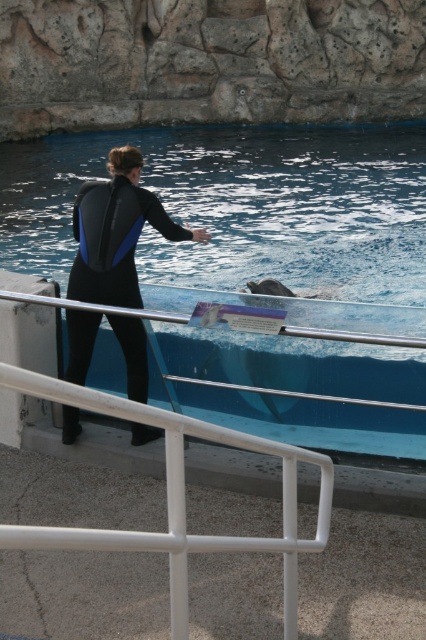
Question: Is blue smooth pool at center above black neoprene wetsuit at center?

Choices:
 (A) no
 (B) yes

Answer: (B)

Question: Which object appears farthest from the camera in this image?

Choices:
 (A) blue smooth pool at center
 (B) black neoprene wetsuit at center

Answer: (A)

Question: Which of the following is the closest to the observer?

Choices:
 (A) (80, 378)
 (B) (109, 340)

Answer: (A)

Question: Does blue smooth pool at center have a lesser width compared to black neoprene wetsuit at center?

Choices:
 (A) no
 (B) yes

Answer: (A)

Question: Which point appears farthest from the camera in this image?

Choices:
 (A) (77, 353)
 (B) (414, 248)

Answer: (B)

Question: Can you confirm if blue smooth pool at center is wider than black neoprene wetsuit at center?

Choices:
 (A) no
 (B) yes

Answer: (B)